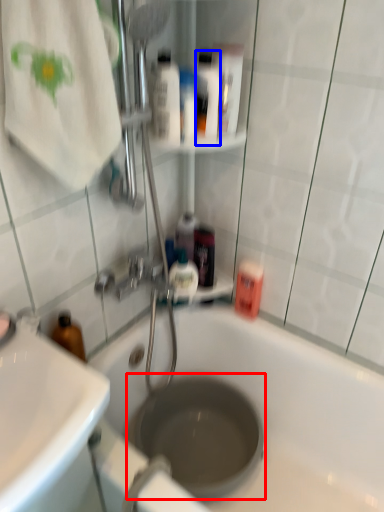
Question: Which of the following is the farthest to the observer, hole (highlighted by a red box) or mouthwash (highlighted by a blue box)?

Choices:
 (A) hole
 (B) mouthwash

Answer: (A)